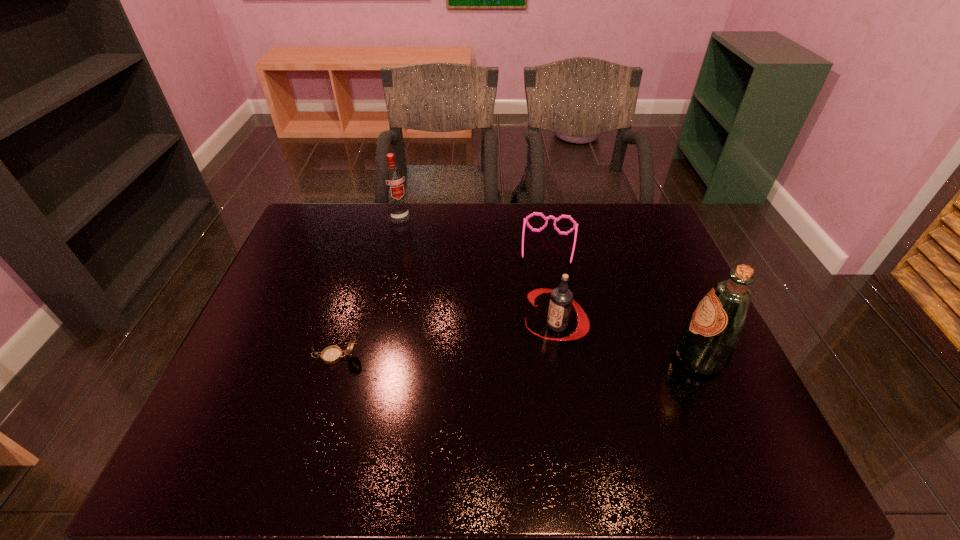
Identify which object is the nearest to the fourth shortest object. Please provide its 2D coordinates. Your answer should be formatted as a tuple, i.e. [(x, y)], where the tuple contains the x and y coordinates of a point satisfying the conditions above.

[(575, 227)]

What are the coordinates of `vacant space that satisfies the following two spatial constraints: 1. on the front side of the rightmost object; 2. on the front-facing side of the vodka` in the screenshot? It's located at (367, 358).

The width and height of the screenshot is (960, 540). I want to click on vacant space that satisfies the following two spatial constraints: 1. on the front side of the spectacles; 2. on the left side of the vodka, so click(393, 247).